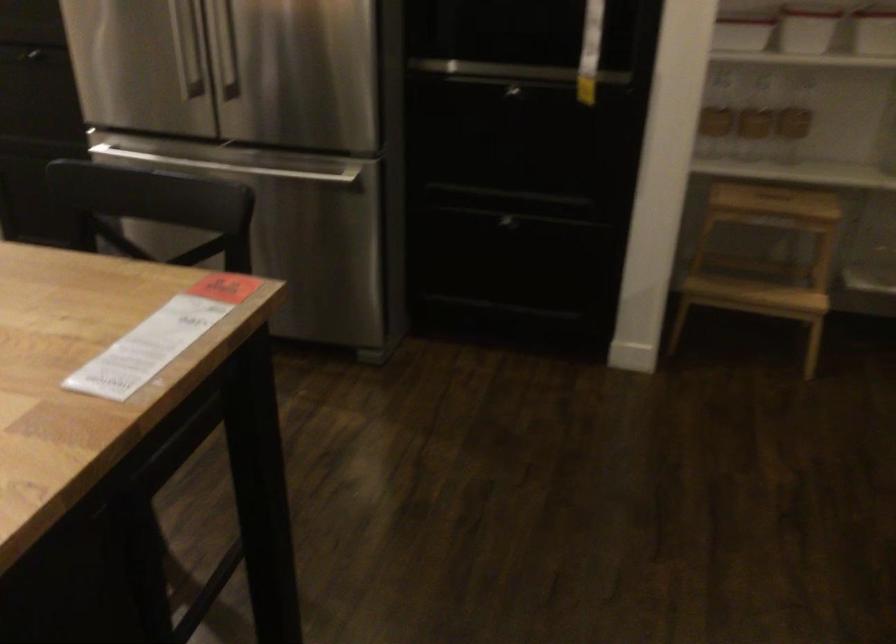
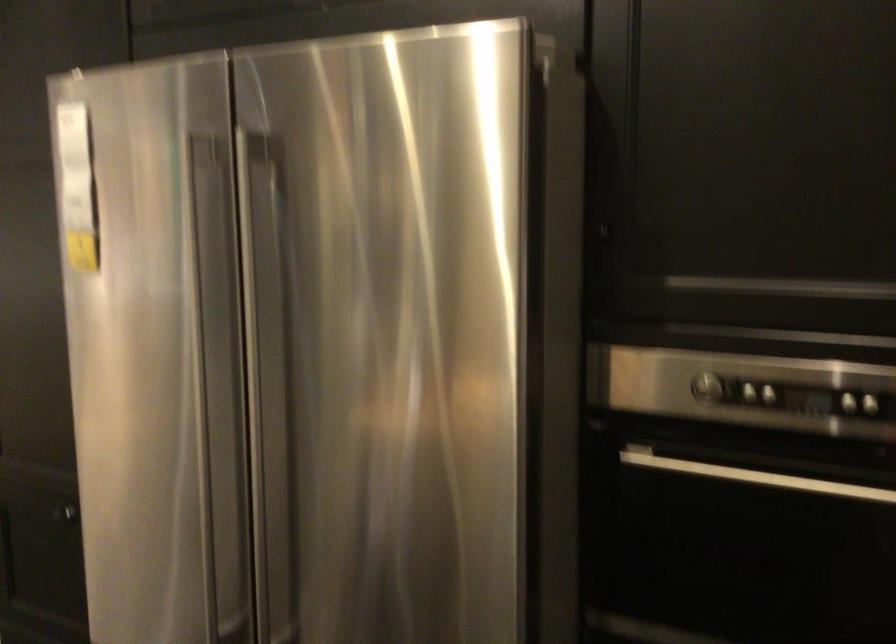
Question: In a continuous first-person perspective shot, in which direction is the camera moving?

Choices:
 (A) Left
 (B) Right
 (C) Forward
 (D) Backward

Answer: (C)